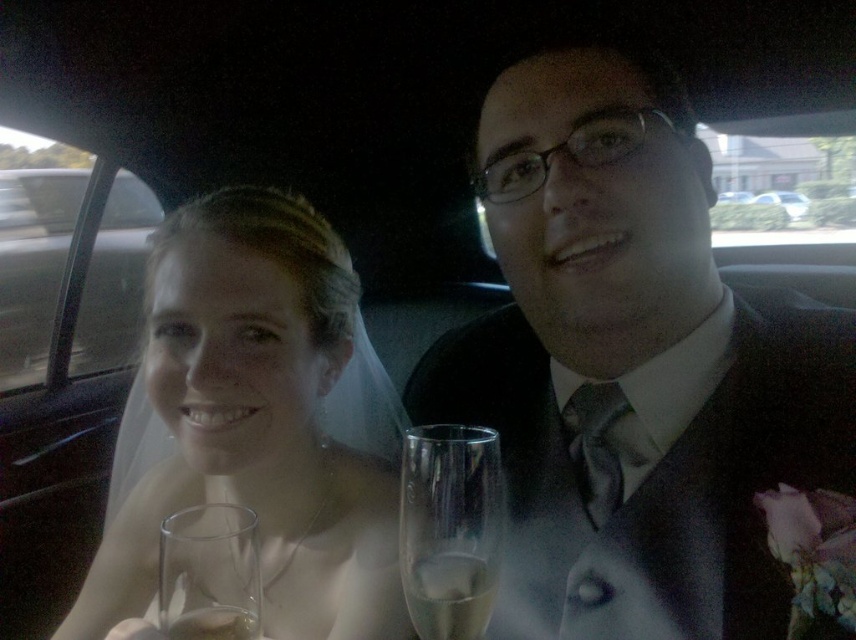
Question: Among these points, which one is farthest from the camera?

Choices:
 (A) (587, 554)
 (B) (792, 192)
 (C) (274, 449)
 (D) (211, 614)

Answer: (B)

Question: From the image, what is the correct spatial relationship of clear glass wine glass at center in relation to white glossy car at center?

Choices:
 (A) below
 (B) above

Answer: (A)

Question: Based on their relative distances, which object is nearer to the translucent white veil at upper left?

Choices:
 (A) white glossy car at center
 (B) clear glass wine glass at lower left
 (C) matte black suit at center
 (D) clear glass wine at lower left

Answer: (C)

Question: Among these objects, which one is farthest from the camera?

Choices:
 (A) matte black suit at center
 (B) clear glass at center

Answer: (A)

Question: Is clear glass wine glass at center below clear glass wine at lower left?

Choices:
 (A) yes
 (B) no

Answer: (B)

Question: Can you confirm if clear glass wine glass at center is positioned below clear glass wine glass at lower left?

Choices:
 (A) no
 (B) yes

Answer: (A)